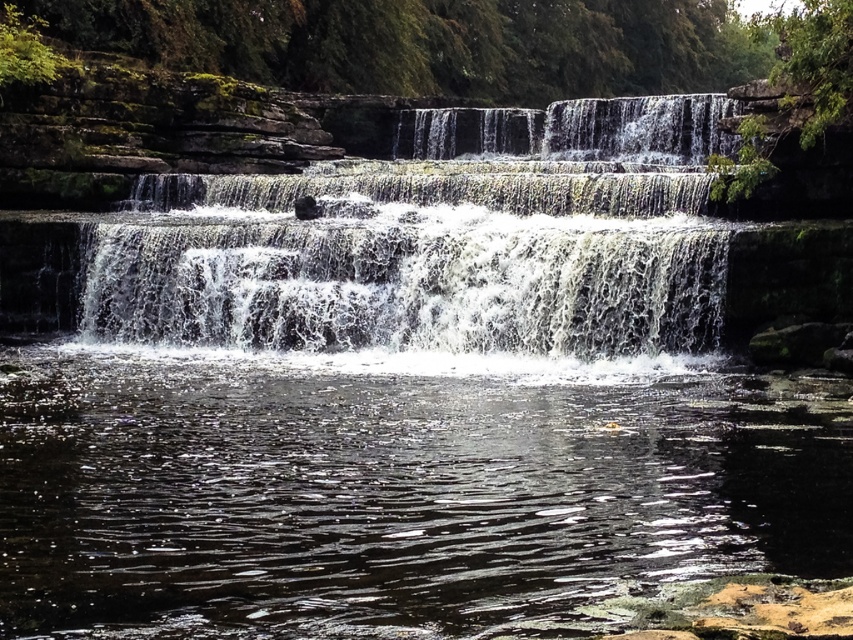
Can you confirm if clear water at center is positioned to the right of white frothy water at center?

Incorrect, clear water at center is not on the right side of white frothy water at center.

Is point (141, 394) positioned after point (518, 140)?

No, it is not.

Does point (440, 525) come behind point (445, 339)?

No, it is not.

Locate an element on the screen. clear water at center is located at coordinates (393, 488).

Does white frothy water at center have a lesser height compared to white frothy water at upper center?

No, white frothy water at center is not shorter than white frothy water at upper center.

What do you see at coordinates (439, 243) in the screenshot?
I see `white frothy water at center` at bounding box center [439, 243].

Locate an element on the screen. white frothy water at center is located at coordinates pyautogui.click(x=439, y=243).

Can you confirm if clear water at center is positioned to the left of white frothy water at upper center?

Indeed, clear water at center is positioned on the left side of white frothy water at upper center.

Who is positioned more to the right, clear water at center or white frothy water at upper center?

Positioned to the right is white frothy water at upper center.

The image size is (853, 640). Identify the location of clear water at center. (x=393, y=488).